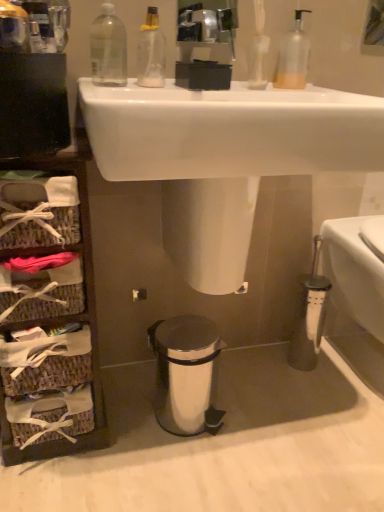
Locate an element on the screen. This screenshot has width=384, height=512. space that is in front of silver metallic trash can at lower center is located at coordinates (x=181, y=467).